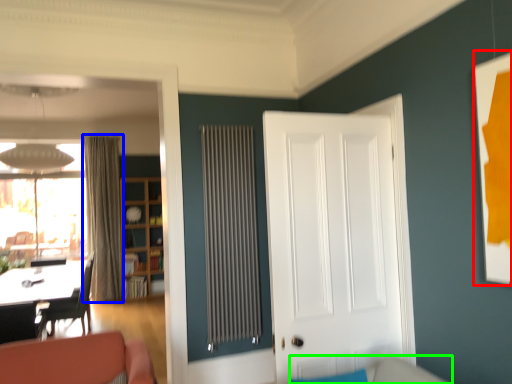
Question: Considering the real-world distances, which object is closest to picture frame (highlighted by a red box)? curtain (highlighted by a blue box) or couch (highlighted by a green box).

Choices:
 (A) curtain
 (B) couch

Answer: (B)